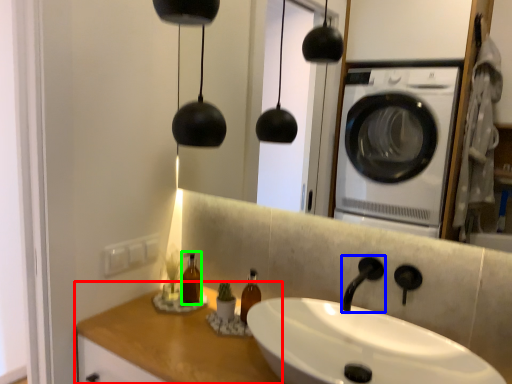
Question: Considering the real-world distances, which object is farthest from counter top (highlighted by a red box)? faucet (highlighted by a blue box) or bottle (highlighted by a green box)?

Choices:
 (A) faucet
 (B) bottle

Answer: (A)